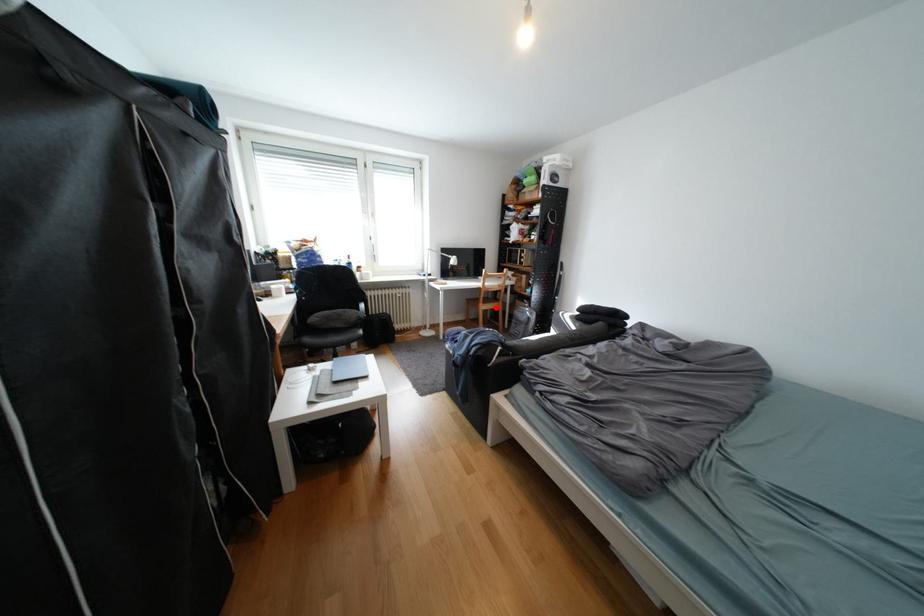
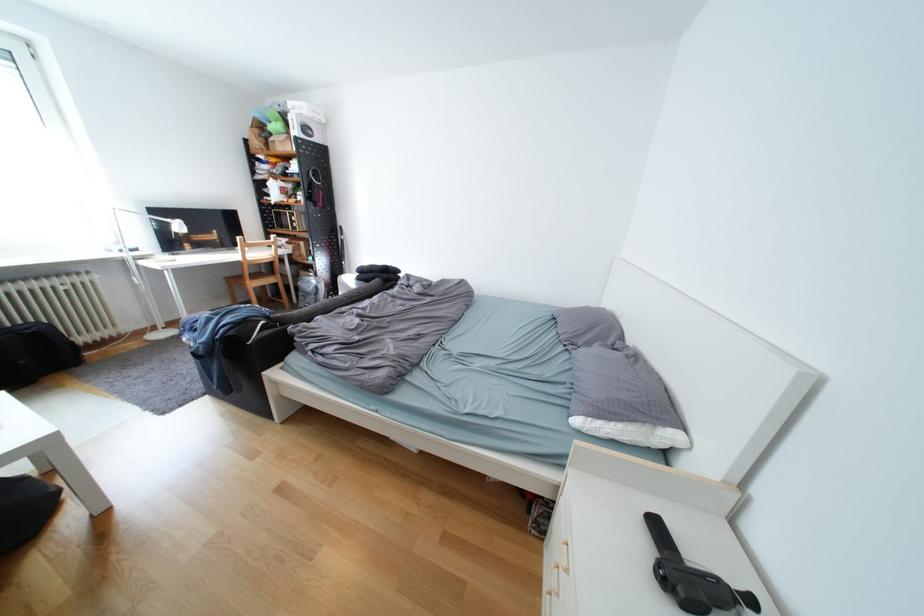
Question: I am providing you with two images of the same scene from different viewpoints. Given a red point in image1, look at the same physical point in image2. Is it:

Choices:
 (A) Closer to the viewpoint
 (B) Farther from the viewpoint

Answer: (A)